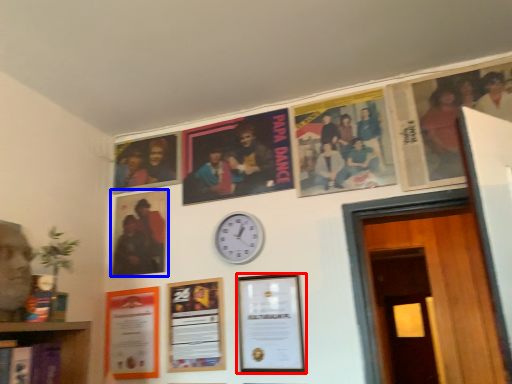
Question: Which point is further to the camera, picture frame (highlighted by a red box) or picture frame (highlighted by a blue box)?

Choices:
 (A) picture frame
 (B) picture frame

Answer: (B)